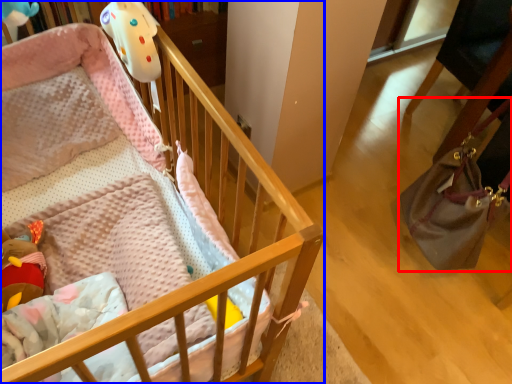
Question: Among these objects, which one is nearest to the camera, handbag (highlighted by a red box) or infant bed (highlighted by a blue box)?

Choices:
 (A) handbag
 (B) infant bed

Answer: (B)